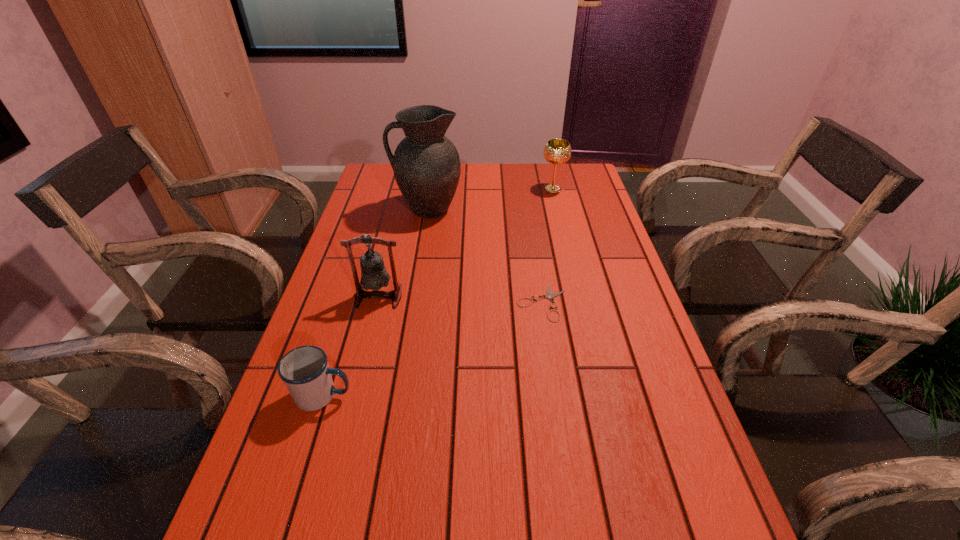
Locate an element on the screen. This screenshot has height=540, width=960. pitcher is located at coordinates (426, 164).

Identify the location of bell. (374, 276).

At what (x,y) coordinates should I click in order to perform the action: click on the third tallest object. Please return your answer as a coordinate pair (x, y). The width and height of the screenshot is (960, 540). Looking at the image, I should click on (557, 151).

Find the location of a particular element. The image size is (960, 540). the nearest object is located at coordinates (304, 370).

Where is `mug`? The image size is (960, 540). mug is located at coordinates (304, 370).

You are a GUI agent. You are given a task and a screenshot of the screen. Output one action in this format:
    pyautogui.click(x=<x>, y=<y>)
    Task: Click on the shortest object
    Image resolution: width=960 pixels, height=540 pixels.
    Given the screenshot: What is the action you would take?
    pyautogui.click(x=549, y=296)

At what (x,y) coordinates should I click in order to perform the action: click on free space located on the side of the tallest object with the handle. Please return your answer as a coordinate pair (x, y). This screenshot has height=540, width=960. Looking at the image, I should click on (356, 209).

Find the location of a particular element. This screenshot has height=540, width=960. free space located on the side of the tallest object with the handle is located at coordinates (369, 209).

Locate an element on the screen. The image size is (960, 540). free point located on the front of the bell is located at coordinates (344, 440).

The image size is (960, 540). Identify the location of vacant space situated 0.090m on the left of the third shortest object. (515, 189).